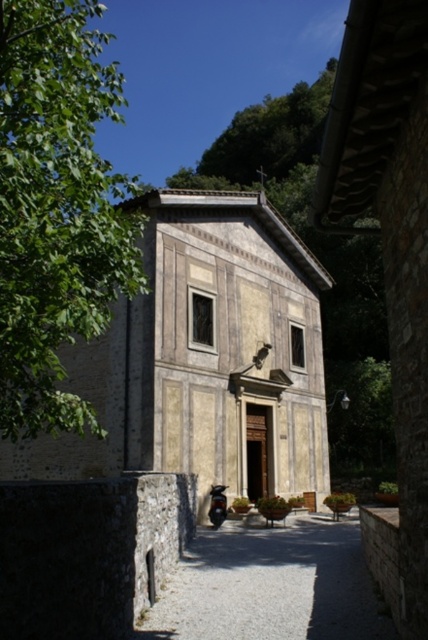
This screenshot has height=640, width=428. Describe the element at coordinates (204, 356) in the screenshot. I see `yellowish stone chapel at center` at that location.

Which is in front, point (127, 396) or point (98, 108)?

Point (98, 108)

This screenshot has height=640, width=428. I want to click on yellowish stone chapel at center, so click(204, 356).